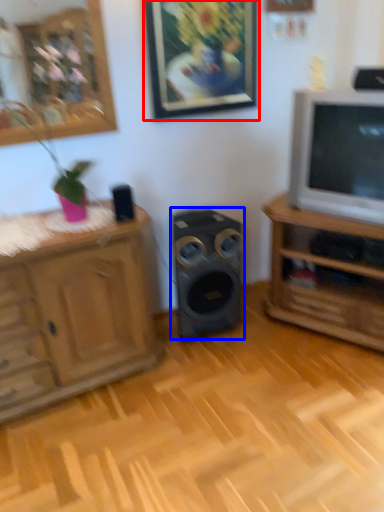
Question: Which of the following is the farthest to the observer, picture frame (highlighted by a red box) or speaker (highlighted by a blue box)?

Choices:
 (A) picture frame
 (B) speaker

Answer: (B)